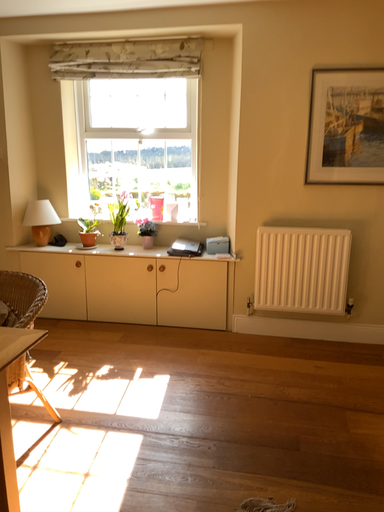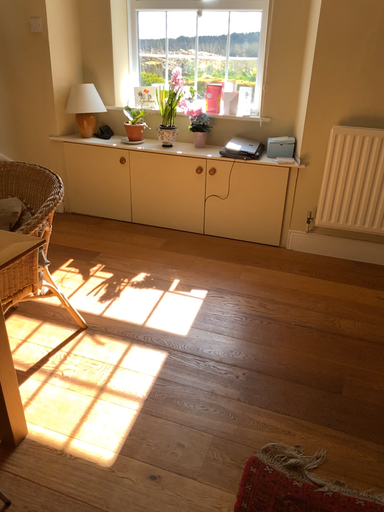
Question: How did the camera likely rotate when shooting the video?

Choices:
 (A) rotated right
 (B) rotated left

Answer: (B)